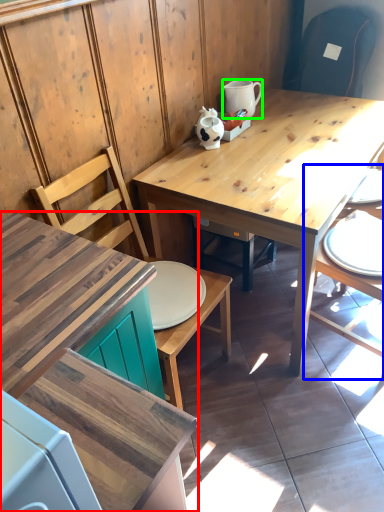
Question: Which object is the farthest from desk (highlighted by a red box)? Choose among these: chair (highlighted by a blue box) or coffee cup (highlighted by a green box).

Choices:
 (A) chair
 (B) coffee cup

Answer: (B)